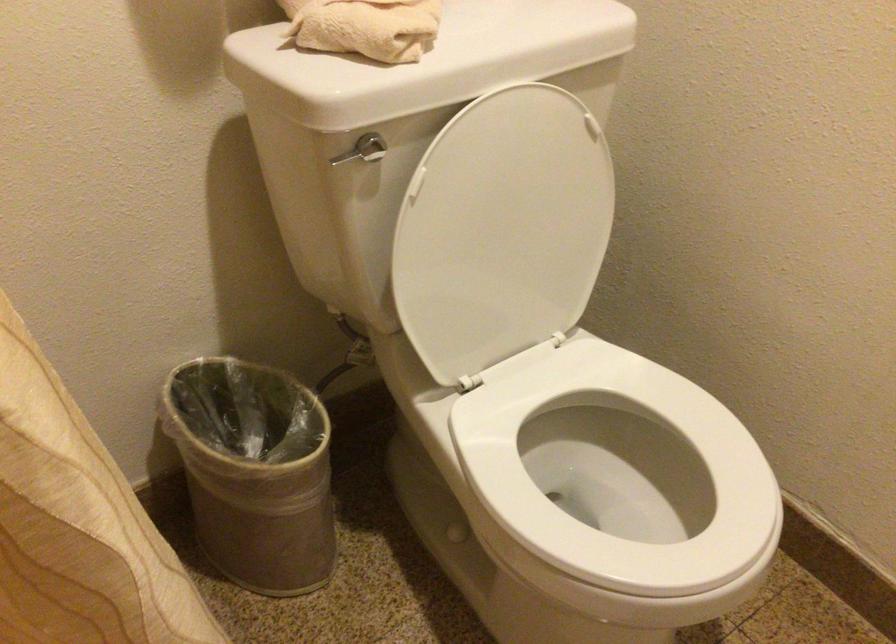
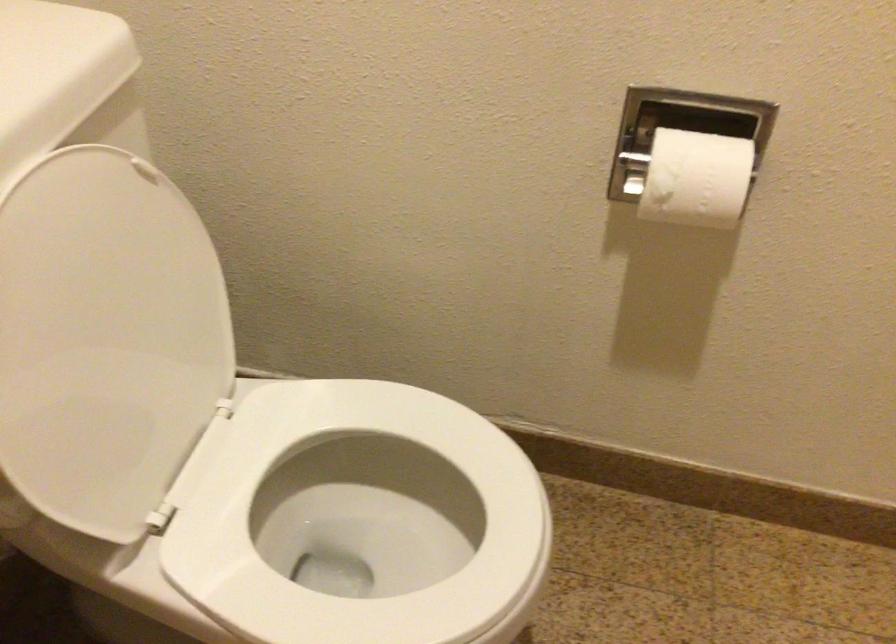
Question: The camera is either moving clockwise (left) or counter-clockwise (right) around the object. The first image is from the beginning of the video and the second image is from the end. Is the camera moving left or right when shooting the video?

Choices:
 (A) Left
 (B) Right

Answer: (A)